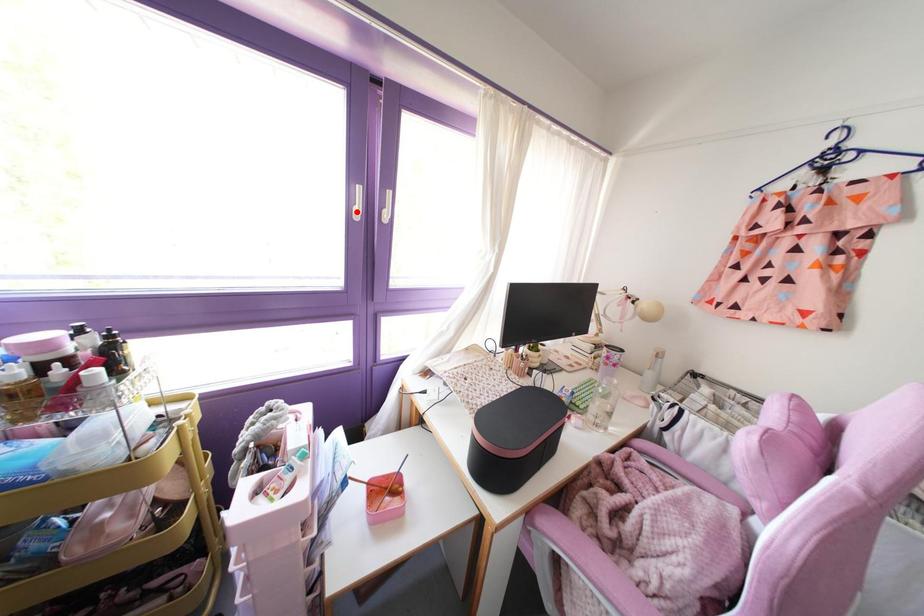
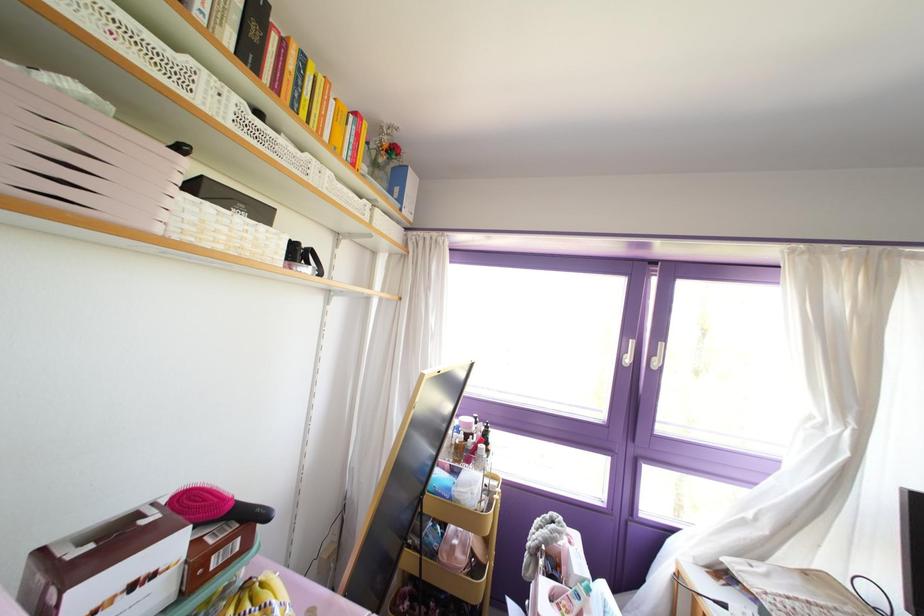
Find the pixel in the second image that matches the highlighted location in the first image.

(626, 360)